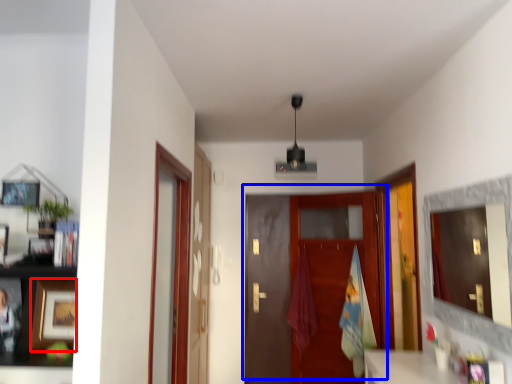
Question: Which point is closer to the camera, picture frame (highlighted by a red box) or door (highlighted by a blue box)?

Choices:
 (A) picture frame
 (B) door

Answer: (A)